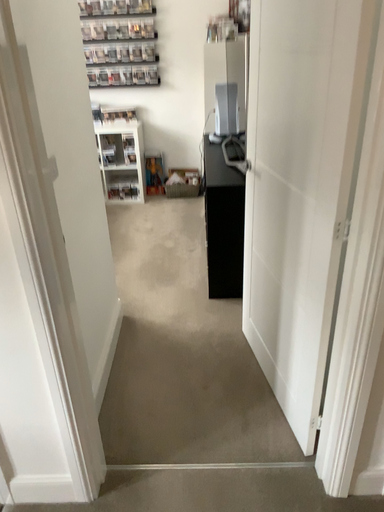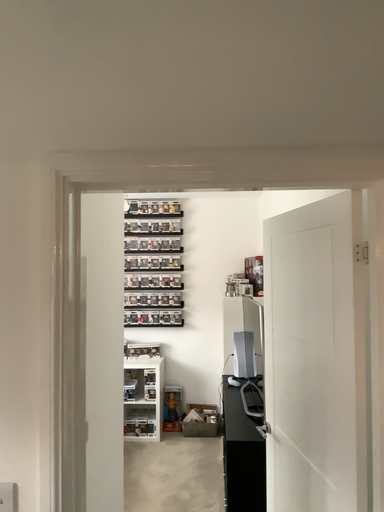
Question: Which way did the camera rotate in the video?

Choices:
 (A) rotated downward
 (B) rotated upward

Answer: (B)